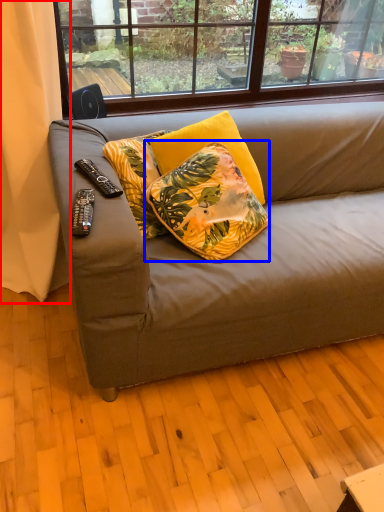
Question: Among these objects, which one is nearest to the camera, curtain (highlighted by a red box) or pillow (highlighted by a blue box)?

Choices:
 (A) curtain
 (B) pillow

Answer: (A)